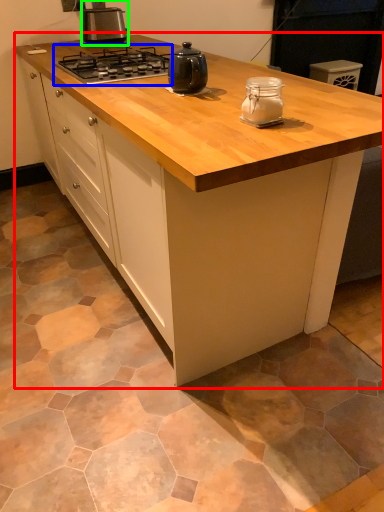
Question: Which object is positioned farthest from cabinetry (highlighted by a red box)? Select from gas stove (highlighted by a blue box) and kitchen appliance (highlighted by a green box).

Choices:
 (A) gas stove
 (B) kitchen appliance

Answer: (B)